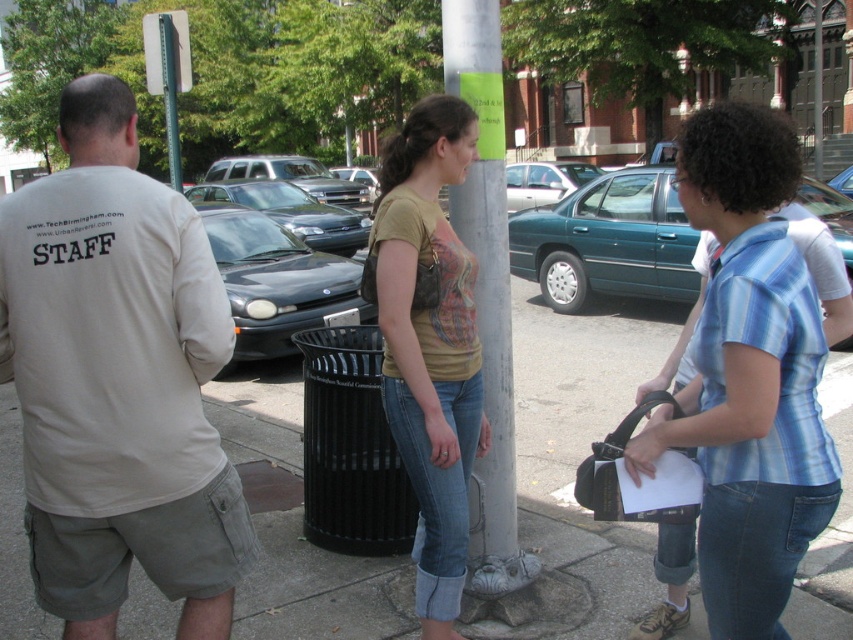
You are a delivery person trying to park your 1.5m tall delivery cart between the shiny black sedan at center and the green metallic pole at upper center. Based on the scene, can your cart fit vertically between them?

The shiny black sedan at center is shorter than the green metallic pole at upper center. Since the cart is 1.5m tall, it can fit vertically between them as long as there is enough horizontal space.